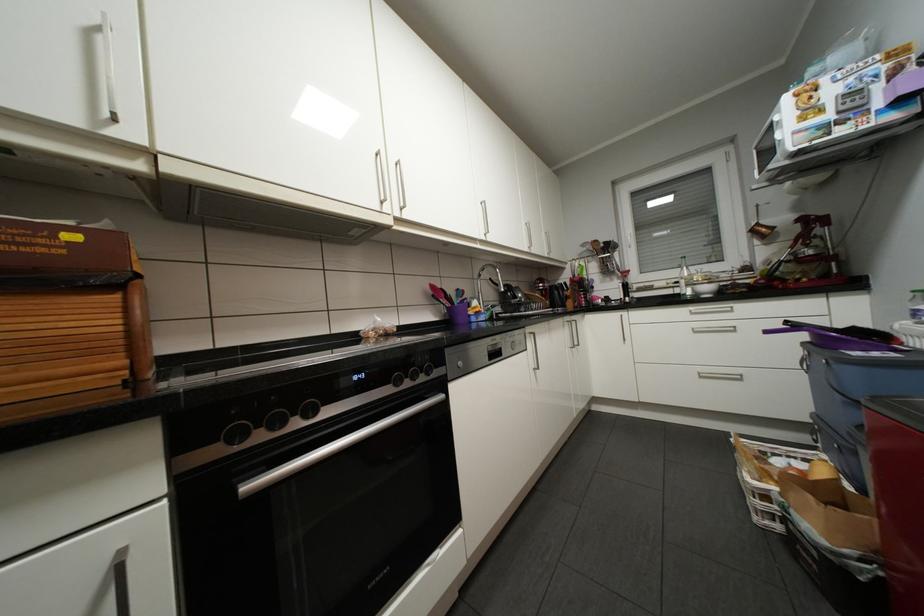
The image size is (924, 616). Describe the element at coordinates (108, 68) in the screenshot. I see `the white window handle` at that location.